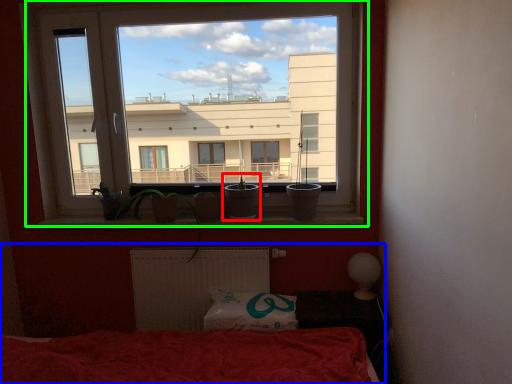
Question: Estimate the real-world distances between objects in this image. Which object is farther from houseplant (highlighted by a red box), bed (highlighted by a blue box) or window (highlighted by a green box)?

Choices:
 (A) bed
 (B) window

Answer: (B)